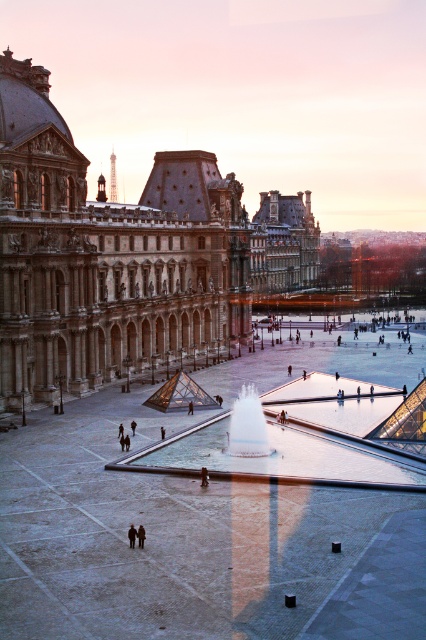
You are a fashion designer observing two coats displayed in the center of the plaza at the Louvre Museum. Which coat is taller, the dark brown leather coat at center or the dark gray fabric coat at center?

The dark brown leather coat at center is taller than the dark gray fabric coat at center.

You are standing at point A, which is located at coordinates point A at point (141, 538). You want to walk to the Louvre Museum entrance, which is at the base of the glass pyramid. Given that the distance between you and the entrance is 56.57 meters, how many minutes would it take you to walk there at a normal pace of 1.4 meters per second?

Walking at 1.4 meters per second, it would take approximately 40.4 minutes to cover 56.57 meters. However, this calculation seems incorrect because 56.57 divided by 1.4 equals approximately 40.4 seconds, not minutes. Therefore, the correct time is about 40.4 seconds.

Based on the photo, you are standing in front of the Louvre Museum and see both the dark brown leather coat at center and the dark gray fabric coat at center. Which coat is positioned lower in the scene?

The dark brown leather coat at center is positioned lower than the dark gray fabric coat at center.